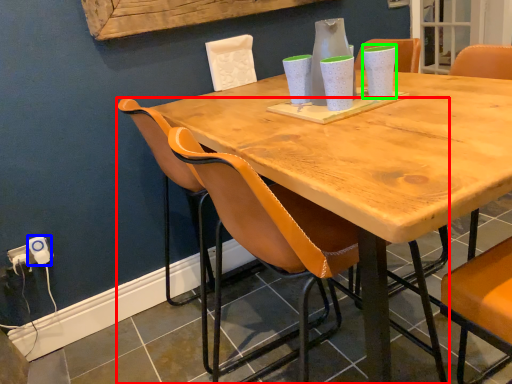
Question: Based on their relative distances, which object is nearer to chair (highlighted by a red box)? Choose from electric outlet (highlighted by a blue box) and vase (highlighted by a green box).

Choices:
 (A) electric outlet
 (B) vase

Answer: (A)